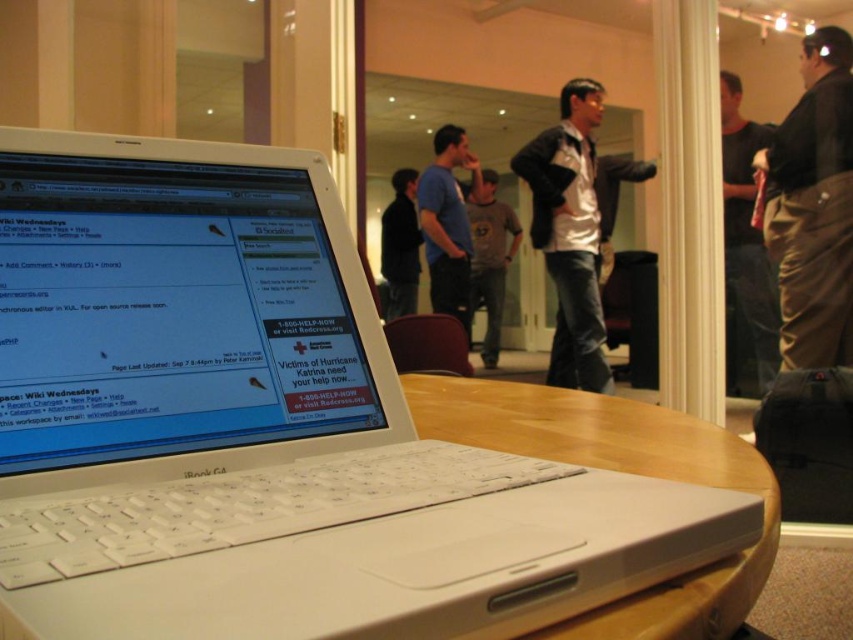
Based on the photo, between white plastic laptop at center and white cotton shirt at center, which one is positioned higher?

Positioned higher is white cotton shirt at center.

Which is in front, point (158, 598) or point (566, 323)?

Point (158, 598) is more forward.

Where is `white plastic laptop at center`? white plastic laptop at center is located at coordinates (264, 428).

Between matte blue shirt at center and gray cotton t-shirt at center, which one has less height?

gray cotton t-shirt at center is shorter.

Locate an element on the screen. This screenshot has height=640, width=853. matte blue shirt at center is located at coordinates (447, 224).

The height and width of the screenshot is (640, 853). In order to click on matte blue shirt at center in this screenshot , I will do `click(447, 224)`.

Is white cotton shirt at center wider than matte blue shirt at center?

Yes, white cotton shirt at center is wider than matte blue shirt at center.

Does point (560, 275) come farther from viewer compared to point (456, 227)?

No, it is not.

Between point (590, 195) and point (450, 125), which one is positioned behind?

Positioned behind is point (450, 125).

In order to click on white cotton shirt at center in this screenshot , I will do (570, 234).